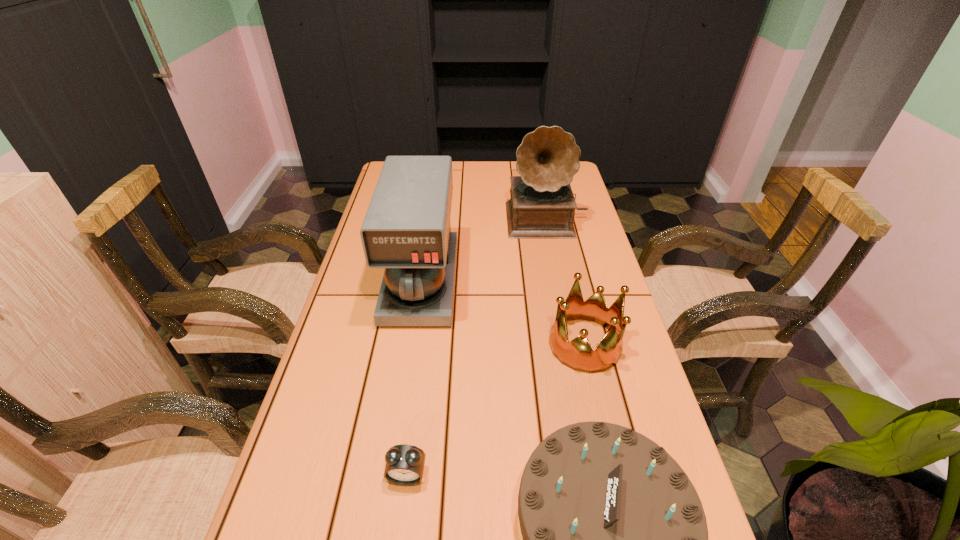
Where is `vacant region at the right edge of the desktop`? vacant region at the right edge of the desktop is located at coordinates (589, 381).

Find the location of `vacant space that's between the alarm clock and the coffee maker`. vacant space that's between the alarm clock and the coffee maker is located at coordinates (414, 379).

Image resolution: width=960 pixels, height=540 pixels. I want to click on free space between the crown and the shortest object, so pos(495,410).

Where is `blank region between the coffee maker and the crown`? blank region between the coffee maker and the crown is located at coordinates (503, 313).

This screenshot has width=960, height=540. Identify the location of free point between the alarm clock and the crown. (495, 410).

Identify the location of vacant area that lies between the shortest object and the crown. (495, 410).

Where is `empty location between the farthest object and the crown`? The width and height of the screenshot is (960, 540). empty location between the farthest object and the crown is located at coordinates (565, 281).

Locate an element on the screen. Image resolution: width=960 pixels, height=540 pixels. free spot between the shortest object and the crown is located at coordinates (495, 410).

The width and height of the screenshot is (960, 540). I want to click on empty location between the farthest object and the coffee maker, so click(484, 251).

The height and width of the screenshot is (540, 960). Identify the location of the third closest object to the coffee maker. (613, 539).